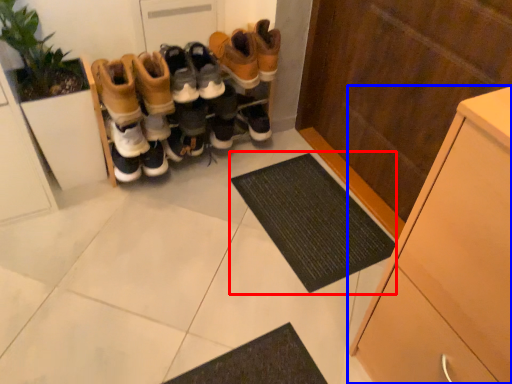
Question: Which object is further to the camera taking this photo, doormat (highlighted by a red box) or cabinetry (highlighted by a blue box)?

Choices:
 (A) doormat
 (B) cabinetry

Answer: (A)